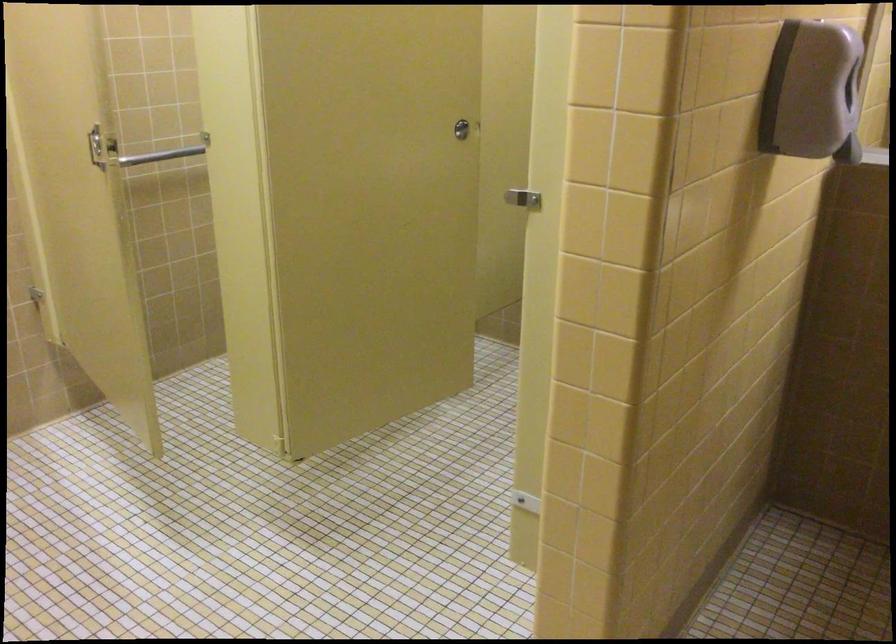
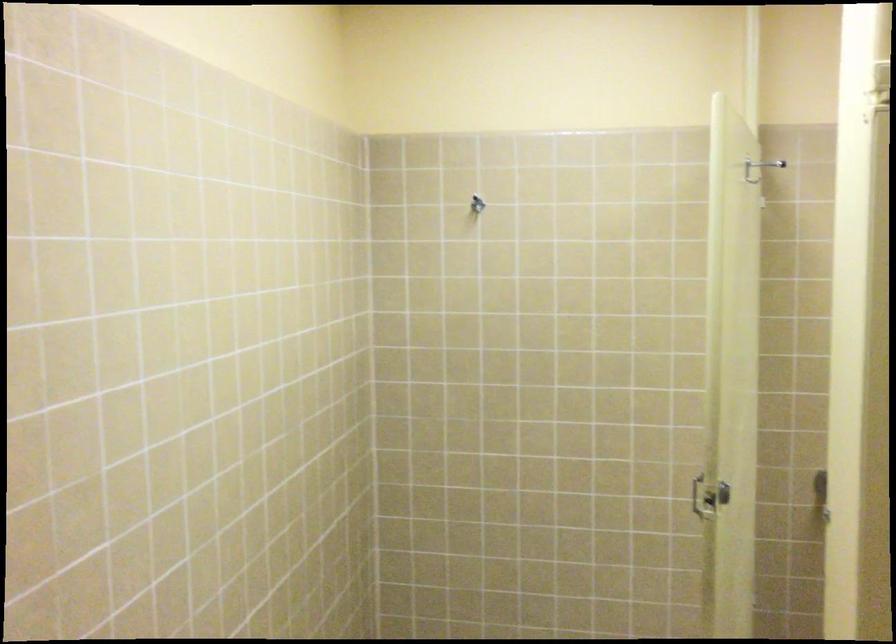
Where in the second image is the point corresponding to point 110,174 from the first image?

(708, 497)